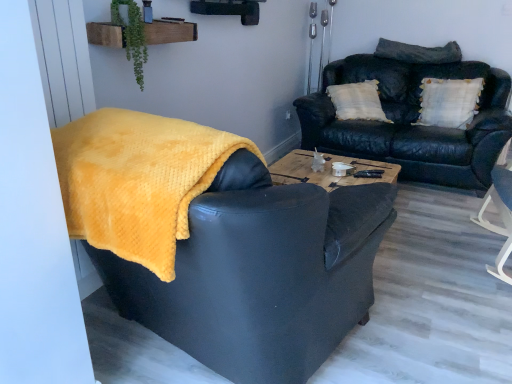
Question: Is green leafy plant at upper center further to the viewer compared to leather couch at upper right?

Choices:
 (A) yes
 (B) no

Answer: (B)

Question: From the image's perspective, would you say green leafy plant at upper center is shown under leather couch at upper right?

Choices:
 (A) yes
 (B) no

Answer: (A)

Question: From a real-world perspective, is green leafy plant at upper center located higher than leather couch at upper right?

Choices:
 (A) no
 (B) yes

Answer: (B)

Question: Considering the relative positions of green leafy plant at upper center and leather couch at upper right in the image provided, is green leafy plant at upper center to the right of leather couch at upper right from the viewer's perspective?

Choices:
 (A) no
 (B) yes

Answer: (A)

Question: Is green leafy plant at upper center smaller than leather couch at upper right?

Choices:
 (A) no
 (B) yes

Answer: (B)

Question: From a real-world perspective, is white textured pillow at upper right, which is counted as the second pillow, starting from the top, physically located above or below leather couch at upper right?

Choices:
 (A) above
 (B) below

Answer: (A)

Question: In terms of size, does white textured pillow at upper right, the first pillow in the bottom-to-top sequence, appear bigger or smaller than leather couch at upper right?

Choices:
 (A) big
 (B) small

Answer: (B)

Question: Is point pyautogui.click(x=445, y=84) closer or farther from the camera than point pyautogui.click(x=431, y=165)?

Choices:
 (A) closer
 (B) farther

Answer: (B)

Question: From the image's perspective, relative to leather couch at upper right, is white textured pillow at upper right, which is counted as the second pillow, starting from the top, above or below?

Choices:
 (A) above
 (B) below

Answer: (A)

Question: Choose the correct answer: Is green leafy plant at upper center inside yellow fuzzy blanket at left or outside it?

Choices:
 (A) outside
 (B) inside

Answer: (A)

Question: In terms of size, does green leafy plant at upper center appear bigger or smaller than yellow fuzzy blanket at left?

Choices:
 (A) big
 (B) small

Answer: (B)

Question: Visually, is green leafy plant at upper center positioned to the left or to the right of yellow fuzzy blanket at left?

Choices:
 (A) right
 (B) left

Answer: (B)

Question: From a real-world perspective, is green leafy plant at upper center positioned above or below yellow fuzzy blanket at left?

Choices:
 (A) below
 (B) above

Answer: (B)

Question: From the image's perspective, is dark gray textured pillow at upper right, the first pillow when ordered from top to bottom, positioned above or below green leafy plant at upper center?

Choices:
 (A) above
 (B) below

Answer: (A)

Question: Considering the positions of dark gray textured pillow at upper right, placed as the 2th pillow when sorted from bottom to top, and green leafy plant at upper center in the image, is dark gray textured pillow at upper right, placed as the 2th pillow when sorted from bottom to top, taller or shorter than green leafy plant at upper center?

Choices:
 (A) tall
 (B) short

Answer: (B)